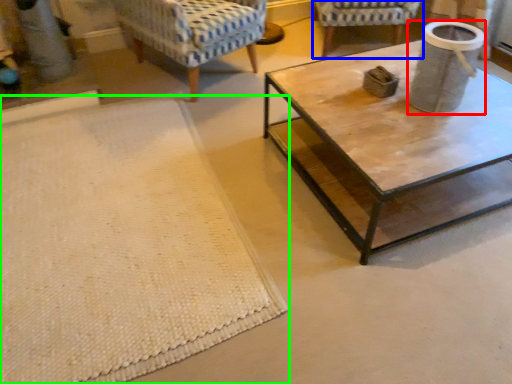
Question: Based on their relative distances, which object is nearer to gray (highlighted by a red box)? Choose from chair (highlighted by a blue box) and mat (highlighted by a green box).

Choices:
 (A) chair
 (B) mat

Answer: (B)